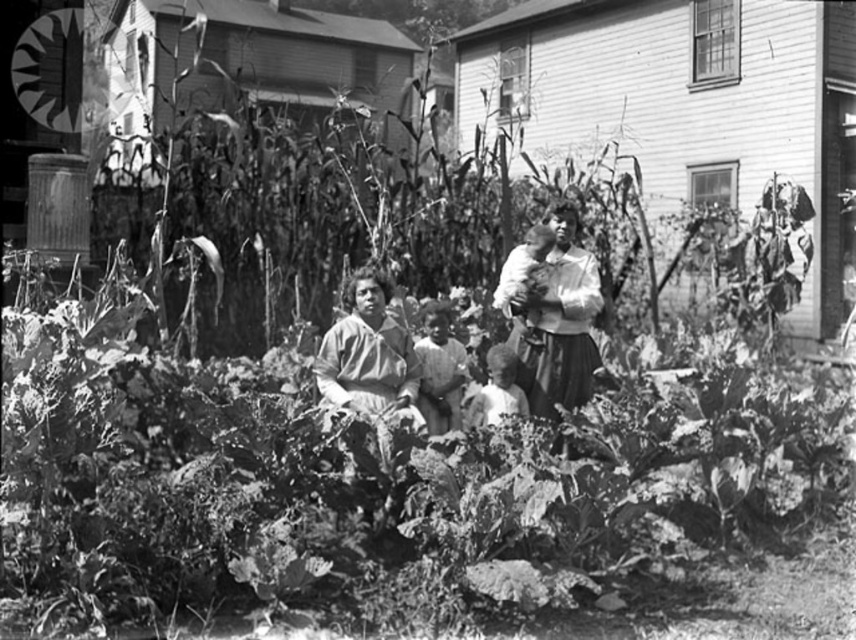
You are a photographer trying to capture a photo of the smooth white shirt at center without including the matte brown dress at center in the frame. Based on their positions, can you position yourself in a way to achieve this?

The matte brown dress at center is to the left of smooth white shirt at center. To exclude the matte brown dress at center, position yourself to the right side of the smooth white shirt at center so the dress is out of frame.

In the family garden scene, there are a smooth dark fabric dress at center and a smooth skin baby at center. Which object is taller?

The smooth dark fabric dress at center is much taller than the smooth skin baby at center.

You are standing in the garden scene and want to find the matte brown dress at center. Based on the coordinates provided, where should you look relative to the central point of the image?

The matte brown dress at center is located at coordinates approximately 55.5 percent along the horizontal axis and 43.1 percent along the vertical axis from the bottom left corner of the image.